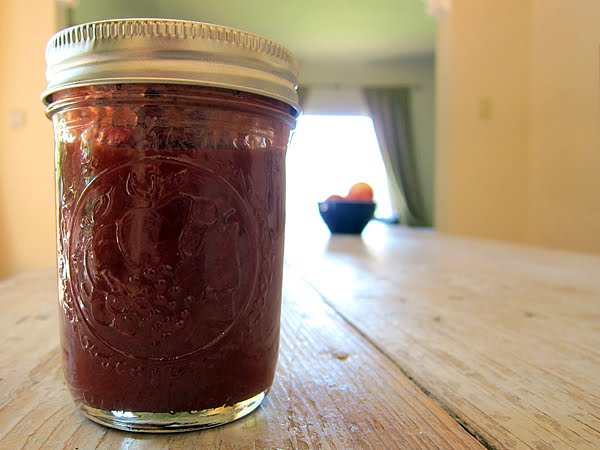
Where is `table`? The image size is (600, 450). table is located at coordinates (462, 349).